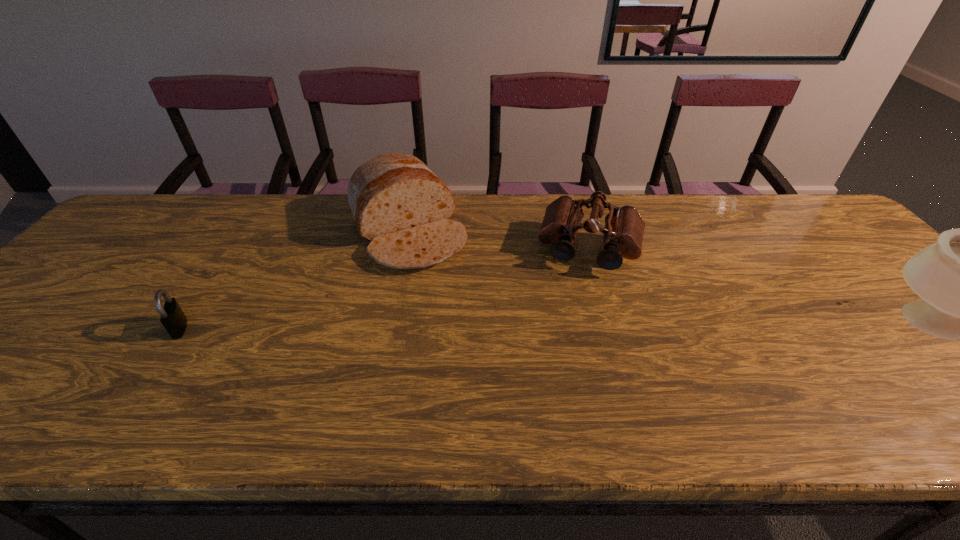
At what (x,y) coordinates should I click in order to perform the action: click on vacant space on the desktop that is between the shortest object and the tallest object and is positioned through the eyepieces of the third object from left to right. Please return your answer as a coordinate pair (x, y). Looking at the image, I should click on (573, 329).

Where is `free space on the desktop that is between the padlock and the pottery and is positioned at the sliced end of the third object from right to left`? The height and width of the screenshot is (540, 960). free space on the desktop that is between the padlock and the pottery and is positioned at the sliced end of the third object from right to left is located at coordinates (466, 328).